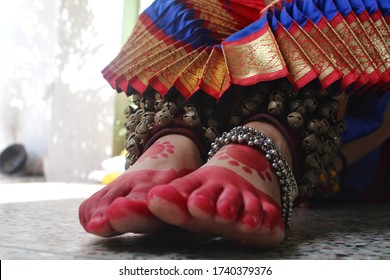
What are the coordinates of `grey wall` in the screenshot? It's located at (45, 72), (39, 22), (75, 104), (6, 117).